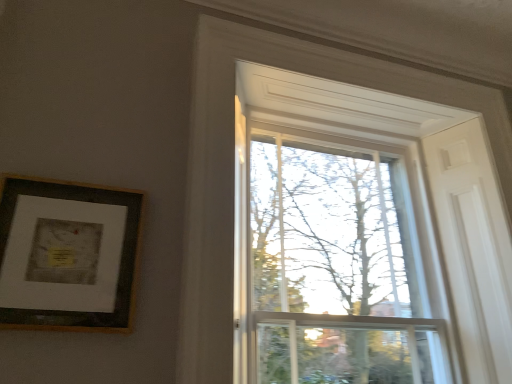
Image resolution: width=512 pixels, height=384 pixels. Identify the location of wooden framed print at upper left. (67, 255).

Describe the element at coordinates (67, 255) in the screenshot. I see `wooden framed print at upper left` at that location.

Locate an element on the screen. This screenshot has width=512, height=384. clear glass window at upper center is located at coordinates (336, 265).

This screenshot has height=384, width=512. Describe the element at coordinates (336, 265) in the screenshot. I see `clear glass window at upper center` at that location.

Identify the location of wooden framed print at upper left. (67, 255).

Between wooden framed print at upper left and clear glass window at upper center, which one appears on the left side from the viewer's perspective?

wooden framed print at upper left is more to the left.

Considering their positions, is wooden framed print at upper left located in front of or behind clear glass window at upper center?

wooden framed print at upper left is in front of clear glass window at upper center.

Which is closer to the camera, (66, 204) or (340, 361)?

Clearly, point (66, 204) is closer to the camera than point (340, 361).

From the image's perspective, would you say wooden framed print at upper left is positioned over clear glass window at upper center?

Indeed, from the image's perspective, wooden framed print at upper left is shown above clear glass window at upper center.

From a real-world perspective, is wooden framed print at upper left located beneath clear glass window at upper center?

Indeed, from a real-world perspective, wooden framed print at upper left is positioned beneath clear glass window at upper center.

In terms of width, does wooden framed print at upper left look wider or thinner when compared to clear glass window at upper center?

In the image, wooden framed print at upper left appears to be more narrow than clear glass window at upper center.

Can you confirm if wooden framed print at upper left is taller than clear glass window at upper center?

Incorrect, the height of wooden framed print at upper left is not larger of that of clear glass window at upper center.

Who is smaller, wooden framed print at upper left or clear glass window at upper center?

With smaller size is wooden framed print at upper left.

Can we say wooden framed print at upper left lies outside clear glass window at upper center?

Yes, wooden framed print at upper left is located beyond the bounds of clear glass window at upper center.

Are wooden framed print at upper left and clear glass window at upper center beside each other?

No, wooden framed print at upper left is not touching clear glass window at upper center.

Is wooden framed print at upper left facing towards clear glass window at upper center?

No, wooden framed print at upper left is not aimed at clear glass window at upper center.

The image size is (512, 384). I want to click on glass window above the wooden framed print at upper left (from a real-world perspective), so click(x=336, y=265).

Considering the relative positions of clear glass window at upper center and wooden framed print at upper left in the image provided, is clear glass window at upper center to the left of wooden framed print at upper left from the viewer's perspective?

Incorrect, clear glass window at upper center is not on the left side of wooden framed print at upper left.

Considering the positions of objects clear glass window at upper center and wooden framed print at upper left in the image provided, who is in front, clear glass window at upper center or wooden framed print at upper left?

wooden framed print at upper left is closer to the camera.

Is point (342, 306) closer or farther from the camera than point (74, 276)?

Point (342, 306) is farther from the camera than point (74, 276).

From the image's perspective, is clear glass window at upper center over wooden framed print at upper left?

Actually, clear glass window at upper center appears below wooden framed print at upper left in the image.

From a real-world perspective, between clear glass window at upper center and wooden framed print at upper left, who is vertically higher?

From a 3D spatial view, clear glass window at upper center is above.

Is clear glass window at upper center thinner than wooden framed print at upper left?

No, clear glass window at upper center is not thinner than wooden framed print at upper left.

Is clear glass window at upper center taller or shorter than wooden framed print at upper left?

Clearly, clear glass window at upper center is taller compared to wooden framed print at upper left.

Who is bigger, clear glass window at upper center or wooden framed print at upper left?

clear glass window at upper center.

Is clear glass window at upper center not inside wooden framed print at upper left?

Absolutely, clear glass window at upper center is external to wooden framed print at upper left.

Is clear glass window at upper center touching wooden framed print at upper left?

They are not placed beside each other.

Looking at this image, could you tell me if clear glass window at upper center is turned towards wooden framed print at upper left?

No, clear glass window at upper center is not facing towards wooden framed print at upper left.

Find the location of `glass window positioned vertically above the wooden framed print at upper left (from a real-world perspective)`. glass window positioned vertically above the wooden framed print at upper left (from a real-world perspective) is located at coordinates (336, 265).

Identify the location of glass window that appears above the wooden framed print at upper left (from a real-world perspective). The height and width of the screenshot is (384, 512). (336, 265).

Image resolution: width=512 pixels, height=384 pixels. Find the location of `picture frame that is in front of the clear glass window at upper center`. picture frame that is in front of the clear glass window at upper center is located at coordinates (67, 255).